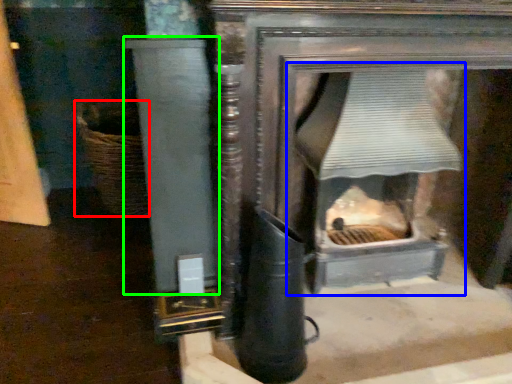
Question: Estimate the real-world distances between objects in this image. Which object is farther from basket (highlighted by a red box), fireplace (highlighted by a blue box) or pillar (highlighted by a green box)?

Choices:
 (A) fireplace
 (B) pillar

Answer: (A)